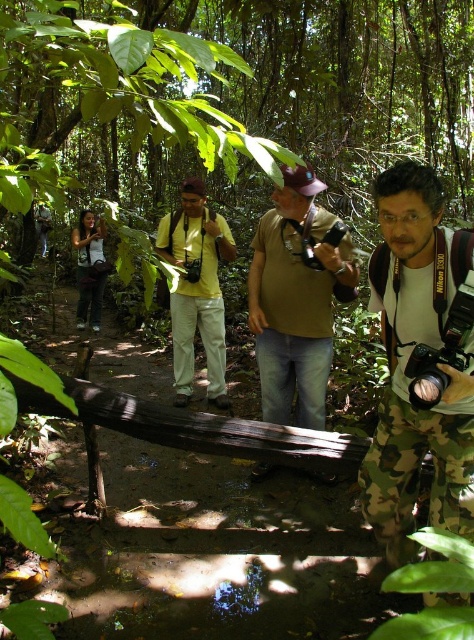
Does point (262, 390) come farther from viewer compared to point (100, 272)?

That is False.

Who is positioned more to the right, brown matte shirt at center or matte black camera at left?

brown matte shirt at center is more to the right.

This screenshot has height=640, width=474. Describe the element at coordinates (297, 298) in the screenshot. I see `brown matte shirt at center` at that location.

At what (x,y) coordinates should I click in order to perform the action: click on brown matte shirt at center. Please return your answer as a coordinate pair (x, y). The width and height of the screenshot is (474, 640). Looking at the image, I should click on (297, 298).

From the picture: Which of these two, black plastic camera at center or matte black camera at left, stands taller?

matte black camera at left

Can you confirm if black plastic camera at center is wider than matte black camera at left?

In fact, black plastic camera at center might be narrower than matte black camera at left.

Image resolution: width=474 pixels, height=640 pixels. Describe the element at coordinates (443, 352) in the screenshot. I see `black plastic camera at center` at that location.

Identify the location of black plastic camera at center. This screenshot has width=474, height=640. (443, 352).

Is yellow matte shirt at center shorter than matte black camera at left?

Incorrect, yellow matte shirt at center's height does not fall short of matte black camera at left's.

I want to click on yellow matte shirt at center, so click(197, 289).